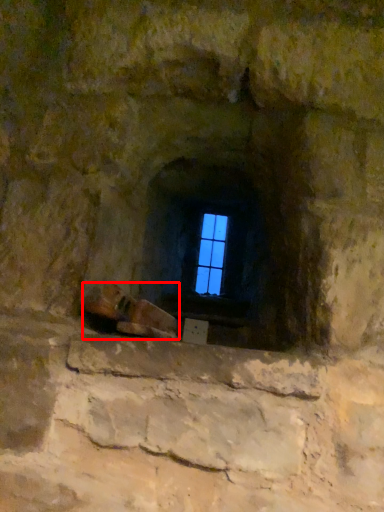
Question: Considering the relative positions of footwear (annotated by the red box) and window in the image provided, where is footwear (annotated by the red box) located with respect to the staircase?

Choices:
 (A) right
 (B) left

Answer: (B)